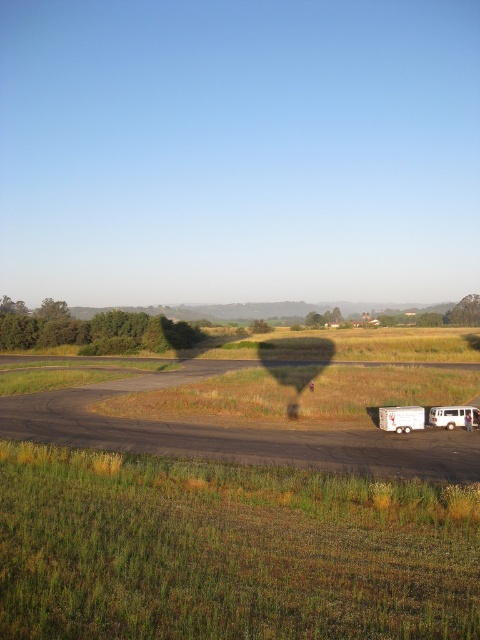
Question: Which object appears farthest from the camera in this image?

Choices:
 (A) white metallic bus at center-right
 (B) green grassy field at center
 (C) brown dirt track at center
 (D) white matte trailer truck at lower right

Answer: (A)

Question: Is green grassy field at center bigger than white matte trailer truck at lower right?

Choices:
 (A) no
 (B) yes

Answer: (B)

Question: Considering the real-world distances, which object is farthest from the white metallic bus at center-right?

Choices:
 (A) brown dirt track at center
 (B) white matte trailer truck at lower right

Answer: (A)

Question: Does brown dirt track at center appear over white metallic bus at center-right?

Choices:
 (A) yes
 (B) no

Answer: (B)

Question: Does green grassy field at center have a lesser width compared to white metallic bus at center-right?

Choices:
 (A) no
 (B) yes

Answer: (A)

Question: Which point is closer to the camera taking this photo?

Choices:
 (A) (177, 435)
 (B) (422, 413)
 (C) (445, 422)
 (D) (370, 628)

Answer: (D)